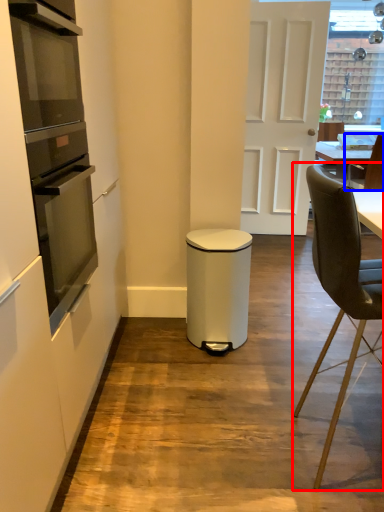
Question: Among these objects, which one is nearest to the camera, chair (highlighted by a red box) or chair (highlighted by a blue box)?

Choices:
 (A) chair
 (B) chair

Answer: (A)